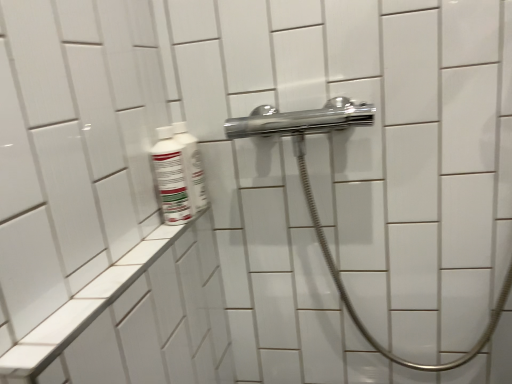
Describe the element at coordinates (191, 166) in the screenshot. The height and width of the screenshot is (384, 512). I see `white glossy bottle at upper left, acting as the 1th mouthwash starting from the back` at that location.

Locate an element on the screen. white glossy bottle at left, the second mouthwash positioned from the back is located at coordinates (170, 178).

In the scene shown: From a real-world perspective, is white glossy bottle at upper left, which is the 2th mouthwash in front-to-back order, physically located above or below white glossy bottle at left, placed as the first mouthwash when sorted from front to back?

In terms of real-world spatial position, white glossy bottle at upper left, which is the 2th mouthwash in front-to-back order, is above white glossy bottle at left, placed as the first mouthwash when sorted from front to back.

Based on their positions, is white glossy bottle at upper left, which is the 2th mouthwash in front-to-back order, located to the left or right of white glossy bottle at left, placed as the first mouthwash when sorted from front to back?

white glossy bottle at upper left, which is the 2th mouthwash in front-to-back order, is to the right of white glossy bottle at left, placed as the first mouthwash when sorted from front to back.

Is white glossy bottle at upper left, which is the 2th mouthwash in front-to-back order, wider or thinner than white glossy bottle at left, placed as the first mouthwash when sorted from front to back?

In the image, white glossy bottle at upper left, which is the 2th mouthwash in front-to-back order, appears to be more narrow than white glossy bottle at left, placed as the first mouthwash when sorted from front to back.

Is white ceramic ledge at lower left taller or shorter than white glossy bottle at upper left, acting as the 1th mouthwash starting from the back?

Considering their sizes, white ceramic ledge at lower left has more height than white glossy bottle at upper left, acting as the 1th mouthwash starting from the back.

In the scene shown: How far apart are white ceramic ledge at lower left and white glossy bottle at upper left, acting as the 1th mouthwash starting from the back?

A distance of 8.86 inches exists between white ceramic ledge at lower left and white glossy bottle at upper left, acting as the 1th mouthwash starting from the back.

Where is `mouthwash that appears on the right of white ceramic ledge at lower left`? The image size is (512, 384). mouthwash that appears on the right of white ceramic ledge at lower left is located at coordinates (191, 166).

From the image's perspective, which one is positioned lower, white ceramic ledge at lower left or white glossy bottle at upper left, which is the 2th mouthwash in front-to-back order?

white ceramic ledge at lower left, from the image's perspective.

Between white glossy bottle at left, the second mouthwash positioned from the back, and white glossy bottle at upper left, which is the 2th mouthwash in front-to-back order, which one has less height?

white glossy bottle at left, the second mouthwash positioned from the back.

Identify the location of mouthwash above the white glossy bottle at left, placed as the first mouthwash when sorted from front to back (from the image's perspective). The width and height of the screenshot is (512, 384). (191, 166).

Is white glossy bottle at left, placed as the first mouthwash when sorted from front to back, not close to white glossy bottle at upper left, which is the 2th mouthwash in front-to-back order?

That's not correct — white glossy bottle at left, placed as the first mouthwash when sorted from front to back, is a little close to white glossy bottle at upper left, which is the 2th mouthwash in front-to-back order.

Is white glossy bottle at left, the second mouthwash positioned from the back, not inside white glossy bottle at upper left, which is the 2th mouthwash in front-to-back order?

Indeed, white glossy bottle at left, the second mouthwash positioned from the back, is completely outside white glossy bottle at upper left, which is the 2th mouthwash in front-to-back order.

The width and height of the screenshot is (512, 384). What are the coordinates of `ledge below the white glossy bottle at upper left, which is the 2th mouthwash in front-to-back order (from the image's perspective)` in the screenshot? It's located at (135, 319).

Is white glossy bottle at upper left, which is the 2th mouthwash in front-to-back order, smaller than white ceramic ledge at lower left?

Yes, white glossy bottle at upper left, which is the 2th mouthwash in front-to-back order, is smaller than white ceramic ledge at lower left.

How different are the orientations of white glossy bottle at upper left, acting as the 1th mouthwash starting from the back, and white ceramic ledge at lower left in degrees?

There is a 0.974-degree angle between the facing directions of white glossy bottle at upper left, acting as the 1th mouthwash starting from the back, and white ceramic ledge at lower left.

Looking at this image, from a real-world perspective, does white glossy bottle at upper left, acting as the 1th mouthwash starting from the back, stand above white ceramic ledge at lower left?

Yes, from a real-world perspective, white glossy bottle at upper left, acting as the 1th mouthwash starting from the back, is on top of white ceramic ledge at lower left.

Who is bigger, white ceramic ledge at lower left or white glossy bottle at left, the second mouthwash positioned from the back?

With larger size is white ceramic ledge at lower left.

Is white ceramic ledge at lower left facing away from white glossy bottle at left, placed as the first mouthwash when sorted from front to back?

white ceramic ledge at lower left does not have its back to white glossy bottle at left, placed as the first mouthwash when sorted from front to back.

Looking at their sizes, would you say white ceramic ledge at lower left is wider or thinner than white glossy bottle at left, the second mouthwash positioned from the back?

white ceramic ledge at lower left is wider than white glossy bottle at left, the second mouthwash positioned from the back.

From a real-world perspective, who is located lower, white glossy bottle at left, placed as the first mouthwash when sorted from front to back, or white ceramic ledge at lower left?

white ceramic ledge at lower left.

The height and width of the screenshot is (384, 512). I want to click on mouthwash that is the 1st one when counting upward from the white ceramic ledge at lower left (from the image's perspective), so click(x=170, y=178).

Does white glossy bottle at left, the second mouthwash positioned from the back, have a lesser height compared to white ceramic ledge at lower left?

Indeed, white glossy bottle at left, the second mouthwash positioned from the back, has a lesser height compared to white ceramic ledge at lower left.

Which object is further away from the camera taking this photo, white glossy bottle at left, placed as the first mouthwash when sorted from front to back, or white ceramic ledge at lower left?

Positioned behind is white glossy bottle at left, placed as the first mouthwash when sorted from front to back.

Locate an element on the screen. The height and width of the screenshot is (384, 512). mouthwash behind the white glossy bottle at left, placed as the first mouthwash when sorted from front to back is located at coordinates (191, 166).

From a real-world perspective, count 2nd mouthwashs upward from the white ceramic ledge at lower left and point to it. Please provide its 2D coordinates.

[(191, 166)]

From the image, which object appears to be farther from white glossy bottle at upper left, acting as the 1th mouthwash starting from the back, white glossy bottle at left, placed as the first mouthwash when sorted from front to back, or white ceramic ledge at lower left?

white ceramic ledge at lower left lies further to white glossy bottle at upper left, acting as the 1th mouthwash starting from the back, than the other object.

When comparing their distances from white glossy bottle at left, the second mouthwash positioned from the back, does white glossy bottle at upper left, which is the 2th mouthwash in front-to-back order, or white ceramic ledge at lower left seem closer?

white glossy bottle at upper left, which is the 2th mouthwash in front-to-back order.

Estimate the real-world distances between objects in this image. Which object is closer to white ceramic ledge at lower left, white glossy bottle at upper left, acting as the 1th mouthwash starting from the back, or white glossy bottle at left, placed as the first mouthwash when sorted from front to back?

Based on the image, white glossy bottle at left, placed as the first mouthwash when sorted from front to back, appears to be nearer to white ceramic ledge at lower left.

Estimate the real-world distances between objects in this image. Which object is further from white glossy bottle at left, placed as the first mouthwash when sorted from front to back, white ceramic ledge at lower left or white glossy bottle at upper left, acting as the 1th mouthwash starting from the back?

Based on the image, white ceramic ledge at lower left appears to be further to white glossy bottle at left, placed as the first mouthwash when sorted from front to back.

Which object lies further to the anchor point white glossy bottle at upper left, acting as the 1th mouthwash starting from the back, white ceramic ledge at lower left or white glossy bottle at left, the second mouthwash positioned from the back?

white ceramic ledge at lower left lies further to white glossy bottle at upper left, acting as the 1th mouthwash starting from the back, than the other object.

Looking at the image, which one is located closer to white ceramic ledge at lower left, white glossy bottle at left, placed as the first mouthwash when sorted from front to back, or white glossy bottle at upper left, which is the 2th mouthwash in front-to-back order?

white glossy bottle at left, placed as the first mouthwash when sorted from front to back, is closer to white ceramic ledge at lower left.

This screenshot has height=384, width=512. In order to click on mouthwash between white glossy bottle at upper left, which is the 2th mouthwash in front-to-back order, and white ceramic ledge at lower left from top to bottom in this screenshot , I will do `click(170, 178)`.